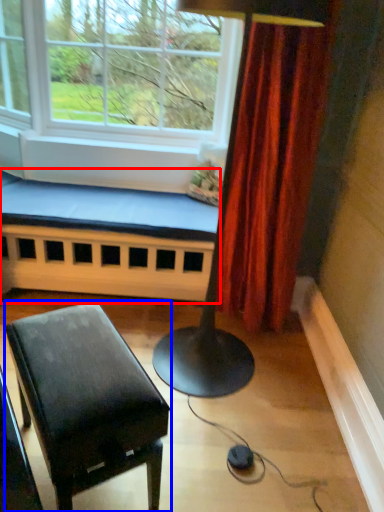
Question: Which point is closer to the camera, church bench (highlighted by a red box) or table (highlighted by a blue box)?

Choices:
 (A) church bench
 (B) table

Answer: (B)